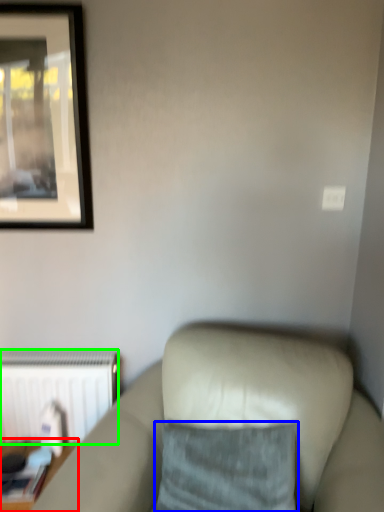
Question: Based on their relative distances, which object is farther from table (highlighted by a red box)? Choose from pillow (highlighted by a blue box) and radiator (highlighted by a green box).

Choices:
 (A) pillow
 (B) radiator

Answer: (A)